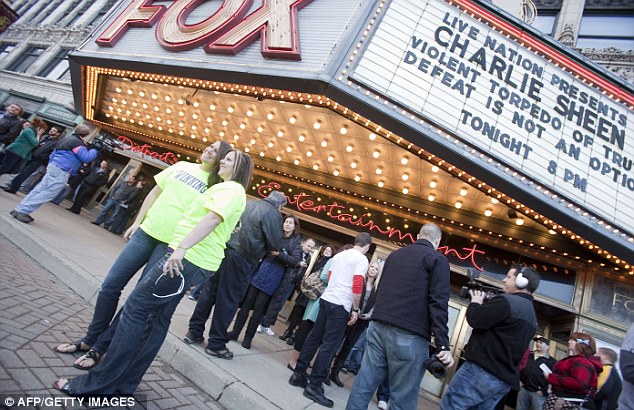
What are the coordinates of `earphones` in the screenshot? It's located at (515, 281).